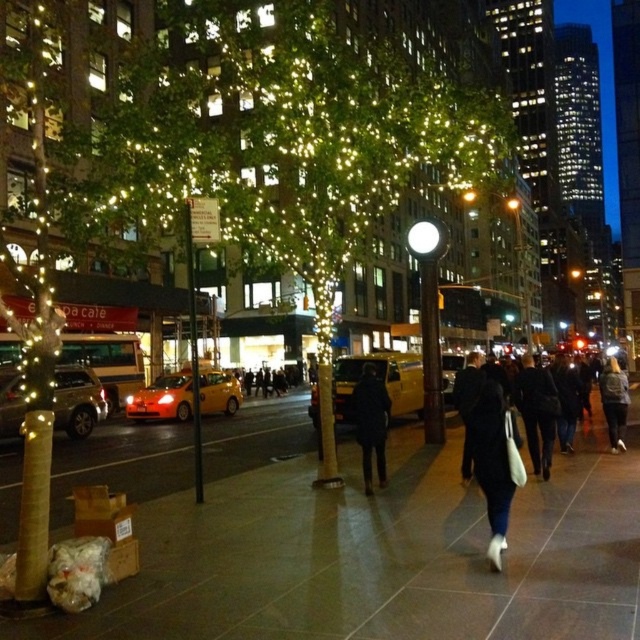
Question: Does dark blue coat at center appear under dark gray jacket at lower right?

Choices:
 (A) no
 (B) yes

Answer: (A)

Question: Among these points, which one is nearest to the camera?

Choices:
 (A) (385, 467)
 (B) (490, 376)
 (C) (426, 464)
 (D) (627, 408)

Answer: (A)

Question: From the image, what is the correct spatial relationship of black leather coat at center in relation to dark blue coat at center?

Choices:
 (A) below
 (B) above

Answer: (B)

Question: Based on their relative distances, which object is nearer to the smooth concrete sidewalk at center?

Choices:
 (A) black leather coat at center
 (B) dark blue coat at center
 (C) black fabric bag at center
 (D) dark gray jacket at lower right

Answer: (C)

Question: Does black fabric bag at center have a greater width compared to dark gray jacket at lower right?

Choices:
 (A) yes
 (B) no

Answer: (B)

Question: Which point is closer to the camera?

Choices:
 (A) (529, 408)
 (B) (369, 456)
 (C) (493, 483)
 (D) (611, 381)

Answer: (C)